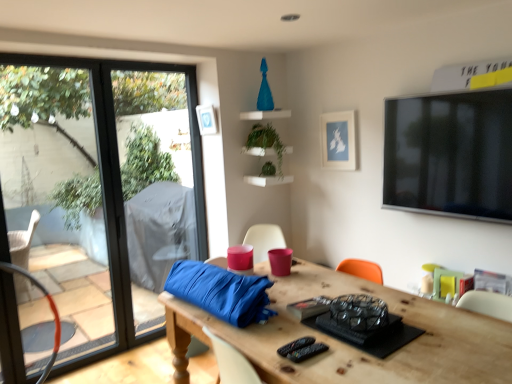
Question: Is point (55, 317) closer or farther from the camera than point (328, 157)?

Choices:
 (A) closer
 (B) farther

Answer: (A)

Question: From the image's perspective, is metallic orange swivel chair at left located above or below matte blue picture frame at upper center, the 2th picture frame viewed from the left?

Choices:
 (A) above
 (B) below

Answer: (B)

Question: Based on their relative distances, which object is nearer to the transparent glass window at left?

Choices:
 (A) green matte plant at center, arranged as the first plant when ordered from the bottom
 (B) blue matte picture frame at upper center, placed as the 2th picture frame when sorted from right to left
 (C) metallic orange swivel chair at left
 (D) green matte plant at center, the 1th plant from the top
 (E) matte blue picture frame at upper center, the 2th picture frame viewed from the left

Answer: (C)

Question: Which of these objects is positioned closest to the transparent glass window at left?

Choices:
 (A) green matte plant at center, arranged as the first plant when ordered from the bottom
 (B) metallic orange swivel chair at left
 (C) wooden table at center
 (D) matte blue picture frame at upper center, which is the 1th picture frame from right to left
 (E) green matte plant at center, which is counted as the second plant, starting from the bottom

Answer: (B)